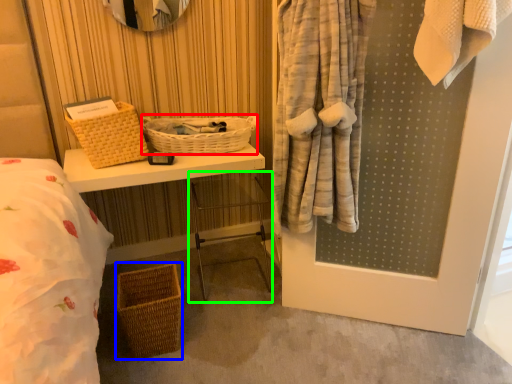
Question: Estimate the real-world distances between objects in this image. Which object is farther from basket (highlighted by a red box), basket (highlighted by a blue box) or chair (highlighted by a green box)?

Choices:
 (A) basket
 (B) chair

Answer: (A)